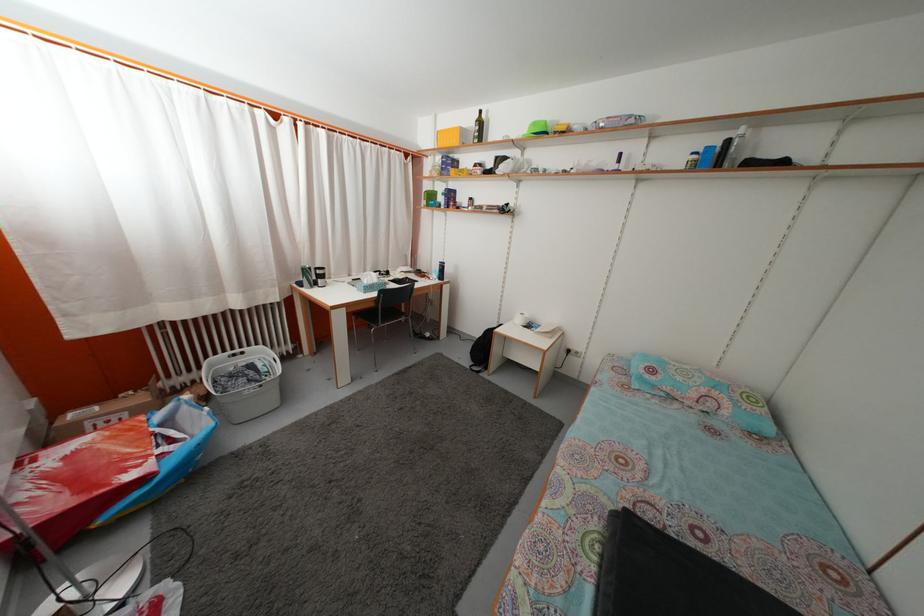
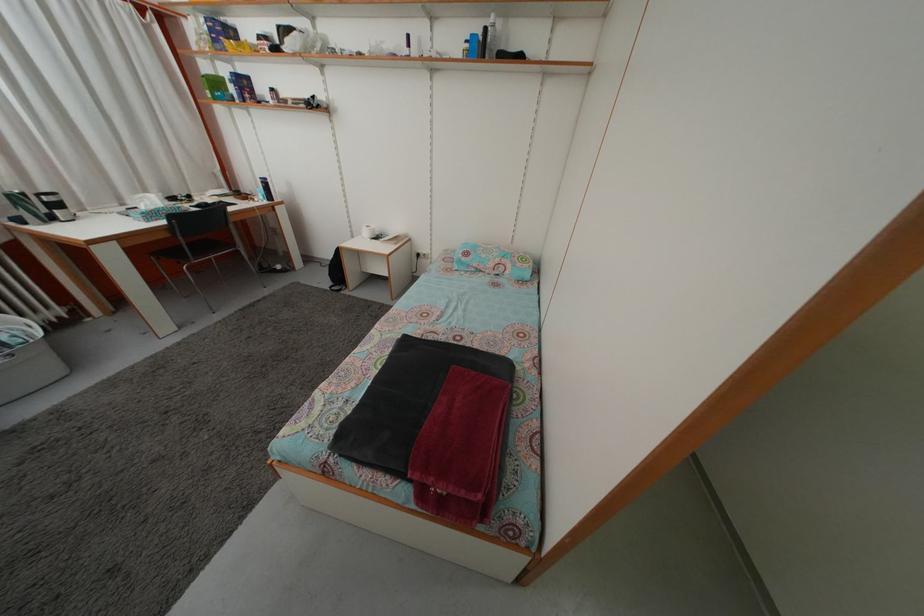
In the second image, find the point that corresponds to point (436, 203) in the first image.

(223, 91)